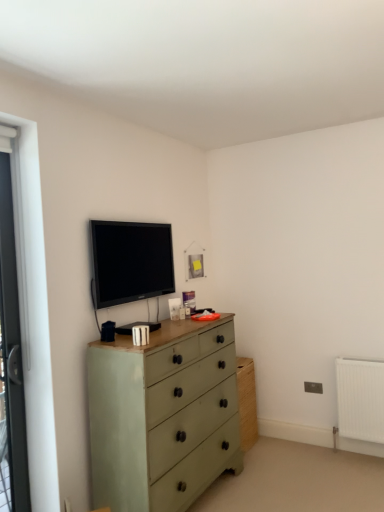
This screenshot has height=512, width=384. What do you see at coordinates (11, 355) in the screenshot?
I see `white plastic screen door at left` at bounding box center [11, 355].

Find the location of a particular element. matte black tv at upper center is located at coordinates (131, 261).

Locate an element on the screen. The height and width of the screenshot is (512, 384). white plastic screen door at left is located at coordinates (11, 355).

Relative to matte green chest of drawers at center, is matte black tv at upper center in front or behind?

matte black tv at upper center is positioned farther from the viewer than matte green chest of drawers at center.

From the image's perspective, which is below, matte black tv at upper center or matte green chest of drawers at center?

From the image's view, matte green chest of drawers at center is below.

Is matte black tv at upper center positioned beyond the bounds of matte green chest of drawers at center?

Yes.

Is matte black tv at upper center looking in the opposite direction of matte green chest of drawers at center?

No, matte green chest of drawers at center is not at the back of matte black tv at upper center.

From the image's perspective, is matte green chest of drawers at center located above matte black tv at upper center?

Actually, matte green chest of drawers at center appears below matte black tv at upper center in the image.

Would you consider matte green chest of drawers at center to be distant from matte black tv at upper center?

No, matte green chest of drawers at center is not far away from matte black tv at upper center.

Which point is more forward, (92, 490) or (119, 302)?

Positioned in front is point (92, 490).

Between matte green chest of drawers at center and matte black tv at upper center, which one has larger width?

With larger width is matte green chest of drawers at center.

Does point (142, 258) appear closer or farther from the camera than point (17, 452)?

Point (142, 258).

Considering the positions of objects matte black tv at upper center and white plastic screen door at left in the image provided, who is in front, matte black tv at upper center or white plastic screen door at left?

white plastic screen door at left is more forward.

Would you say matte black tv at upper center contains white plastic screen door at left?

No, white plastic screen door at left is located outside of matte black tv at upper center.

From the image's perspective, is matte black tv at upper center positioned above or below white plastic screen door at left?

matte black tv at upper center is situated higher than white plastic screen door at left in the image.

Based on the photo, which object is positioned more to the left, white plastic screen door at left or matte black tv at upper center?

Positioned to the left is white plastic screen door at left.

Locate an element on the screen. The image size is (384, 512). screen door lying below the matte black tv at upper center (from the image's perspective) is located at coordinates (11, 355).

Is white plastic screen door at left facing towards matte black tv at upper center?

No.

Relative to matte black tv at upper center, is white plastic screen door at left in front or behind?

Clearly, white plastic screen door at left is in front of matte black tv at upper center.

Find the location of a particular element. This screenshot has height=512, width=384. chest of drawers in front of the white plastic screen door at left is located at coordinates (162, 416).

Is white plastic screen door at left at the back of matte green chest of drawers at center?

matte green chest of drawers at center is not turned away from white plastic screen door at left.

Could white plastic screen door at left be considered to be inside matte green chest of drawers at center?

Actually, white plastic screen door at left is outside matte green chest of drawers at center.

Would you say white plastic screen door at left is outside matte green chest of drawers at center?

Yes, white plastic screen door at left is located beyond the bounds of matte green chest of drawers at center.

From the image's perspective, which is above, white plastic screen door at left or matte green chest of drawers at center?

From the image's view, white plastic screen door at left is above.

Would you say white plastic screen door at left is a long distance from matte green chest of drawers at center?

white plastic screen door at left is actually quite close to matte green chest of drawers at center.

Image resolution: width=384 pixels, height=512 pixels. I want to click on chest of drawers in front of the matte black tv at upper center, so click(162, 416).

Image resolution: width=384 pixels, height=512 pixels. In order to click on television that is on the left side of matte green chest of drawers at center in this screenshot , I will do `click(131, 261)`.

From the image, which object appears to be nearer to matte green chest of drawers at center, white plastic screen door at left or matte black tv at upper center?

Among the two, matte black tv at upper center is located nearer to matte green chest of drawers at center.

Based on their spatial positions, is matte green chest of drawers at center or matte black tv at upper center further from white plastic screen door at left?

Among the two, matte green chest of drawers at center is located further to white plastic screen door at left.

Based on their spatial positions, is matte green chest of drawers at center or white plastic screen door at left further from matte black tv at upper center?

white plastic screen door at left is further to matte black tv at upper center.

Considering their positions, is white plastic screen door at left positioned closer to matte black tv at upper center than matte green chest of drawers at center?

The object closer to matte black tv at upper center is matte green chest of drawers at center.

Considering their positions, is matte black tv at upper center positioned further to matte green chest of drawers at center than white plastic screen door at left?

white plastic screen door at left.

When comparing their distances from white plastic screen door at left, does matte black tv at upper center or matte green chest of drawers at center seem further?

Among the two, matte green chest of drawers at center is located further to white plastic screen door at left.

The height and width of the screenshot is (512, 384). Identify the location of screen door between matte black tv at upper center and matte green chest of drawers at center from top to bottom. click(x=11, y=355).